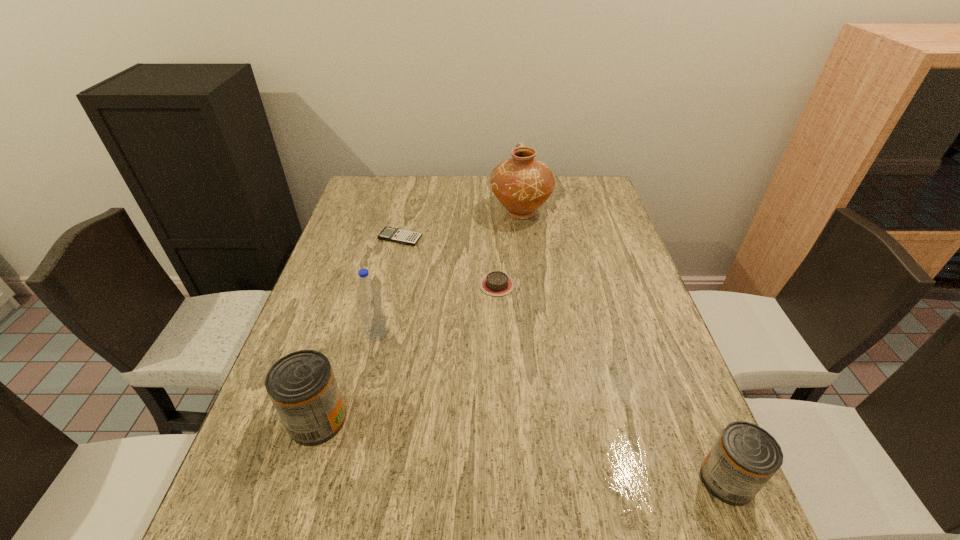
This screenshot has width=960, height=540. What are the coordinates of `free space located 0.250m on the left of the nearest object` in the screenshot? It's located at (564, 480).

You are a GUI agent. You are given a task and a screenshot of the screen. Output one action in this format:
    pyautogui.click(x=<x>, y=<y>)
    Task: Click on the vacant space positioned 0.050m on the side of the pottery with the handle
    The image size is (960, 540).
    Given the screenshot: What is the action you would take?
    pyautogui.click(x=517, y=189)

At what (x,y) coordinates should I click in order to perform the action: click on vacant space situated on the side of the pottery with the handle. Please return your answer as a coordinate pair (x, y). Image resolution: width=960 pixels, height=540 pixels. Looking at the image, I should click on (516, 185).

Locate an element on the screen. This screenshot has height=540, width=960. vacant region located 0.110m on the side of the pottery with the handle is located at coordinates (516, 181).

Where is `free space located 0.090m on the right of the chocolate cake`? Image resolution: width=960 pixels, height=540 pixels. free space located 0.090m on the right of the chocolate cake is located at coordinates (547, 285).

Locate an element on the screen. The height and width of the screenshot is (540, 960). free spot located 0.250m on the right of the calculator is located at coordinates (502, 238).

You are a GUI agent. You are given a task and a screenshot of the screen. Output one action in this format:
    pyautogui.click(x=<x>, y=<y>)
    Task: Click on the free region located on the front of the fourth farthest object
    Image resolution: width=960 pixels, height=540 pixels.
    Given the screenshot: What is the action you would take?
    pyautogui.click(x=368, y=368)

This screenshot has width=960, height=540. I want to click on object situated at the far edge, so click(522, 184).

Locate an element on the screen. object that is at the near edge is located at coordinates (745, 456).

Locate an element on the screen. can that is at the left edge is located at coordinates (301, 385).